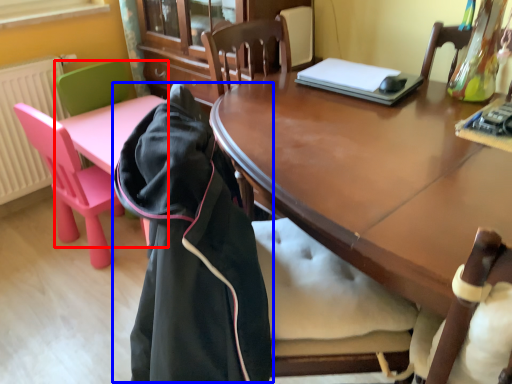
Question: Among these objects, which one is farthest to the camera, chair (highlighted by a red box) or cloak (highlighted by a blue box)?

Choices:
 (A) chair
 (B) cloak

Answer: (A)